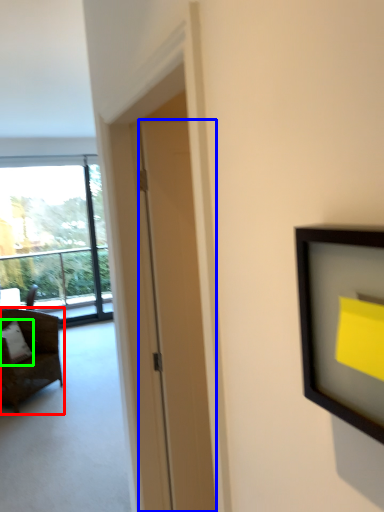
Question: Considering the real-world distances, which object is farthest from chair (highlighted by a red box)? door (highlighted by a blue box) or pillow (highlighted by a green box)?

Choices:
 (A) door
 (B) pillow

Answer: (A)